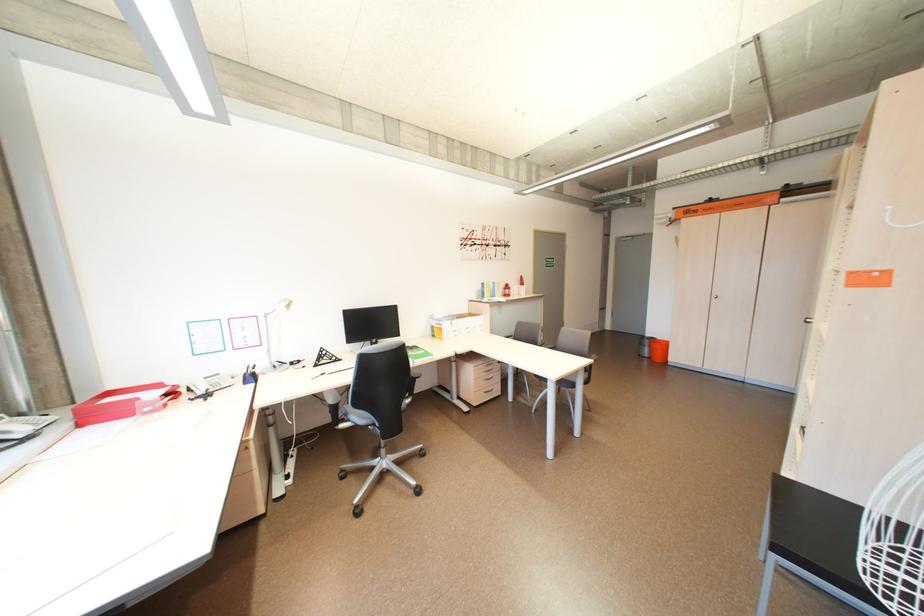
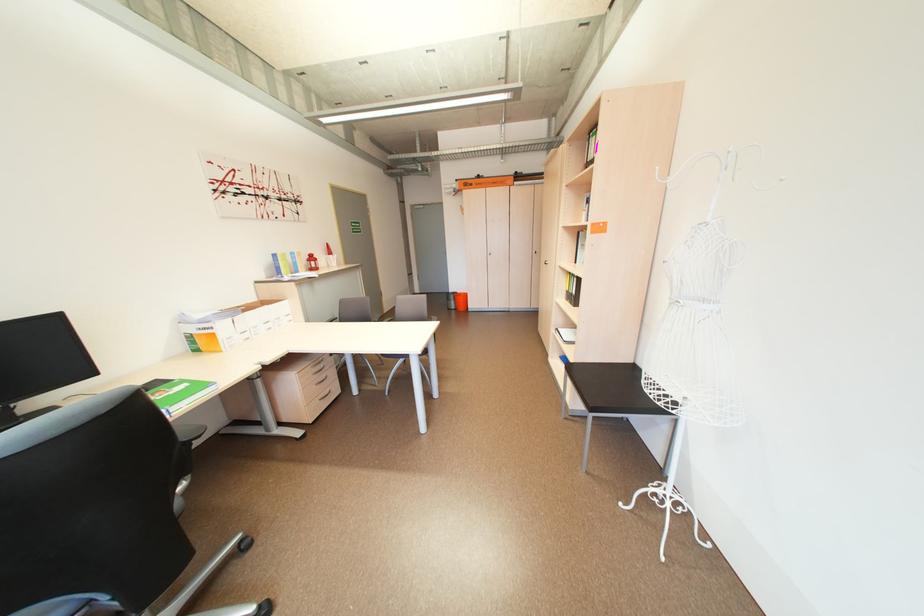
In the second image, find the point that corresponds to [544,376] in the first image.

(392, 355)